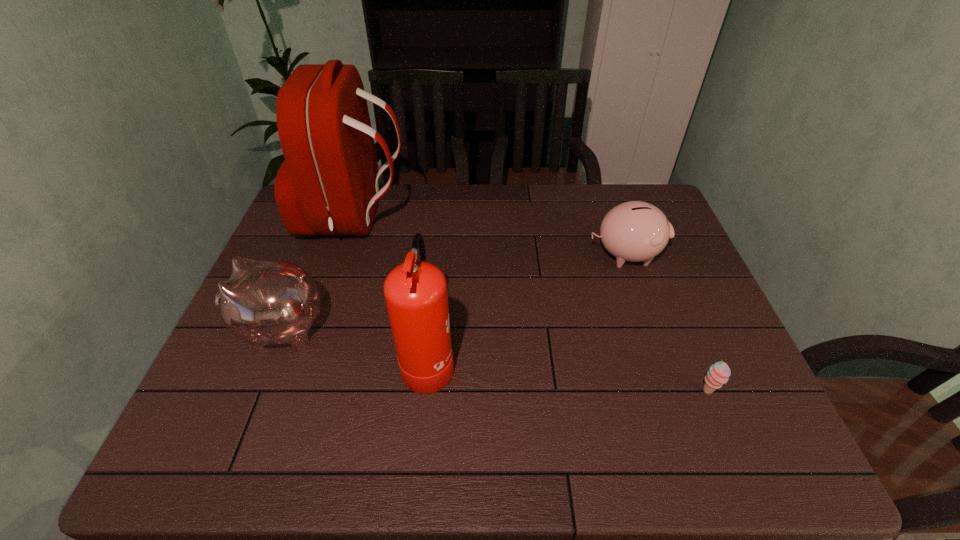
At what (x,y) coordinates should I click in order to perform the action: click on vacant space that satisfies the following two spatial constraints: 1. towards the nozzle of the third object from right to left; 2. on the right side of the shortest object. Please return your answer as a coordinate pair (x, y). Image resolution: width=960 pixels, height=540 pixels. Looking at the image, I should click on (425, 392).

Identify the location of vacant space that satisfies the following two spatial constraints: 1. on the strap side of the backpack; 2. on the left side of the shortest object. (300, 392).

Locate an element on the screen. This screenshot has width=960, height=540. free space that satisfies the following two spatial constraints: 1. on the strap side of the farther piggy bank; 2. on the right side of the tallest object is located at coordinates (344, 255).